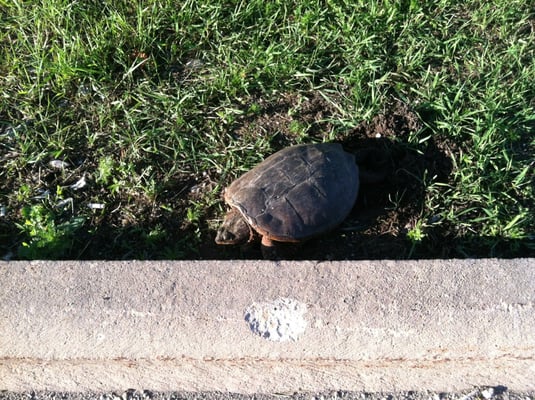
Find the location of a particular element. The width and height of the screenshot is (535, 400). shell plates is located at coordinates (277, 224), (312, 209), (335, 182), (249, 199), (274, 184), (299, 168), (320, 159), (246, 177), (270, 159), (297, 151).